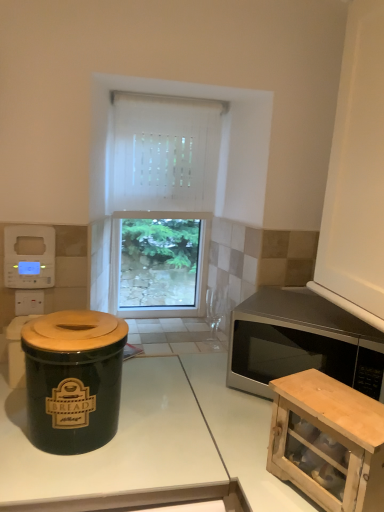
Question: Is satin silver microwave at right situated inside white plastic digital clock at upper left or outside?

Choices:
 (A) outside
 (B) inside

Answer: (A)

Question: Is satin silver microwave at right bigger or smaller than white plastic digital clock at upper left?

Choices:
 (A) small
 (B) big

Answer: (B)

Question: Which of these objects is positioned closest to the white fabric curtain at center?

Choices:
 (A) white plastic digital clock at upper left
 (B) white glossy countertop at center
 (C) wooden cabinet at lower right
 (D) matte black crock pot at left
 (E) satin silver microwave at right

Answer: (A)

Question: Estimate the real-world distances between objects in this image. Which object is closer to the white plastic digital clock at upper left?

Choices:
 (A) satin silver microwave at right
 (B) matte black crock pot at left
 (C) white glossy countertop at center
 (D) wooden cabinet at lower right
 (E) white fabric curtain at center

Answer: (B)